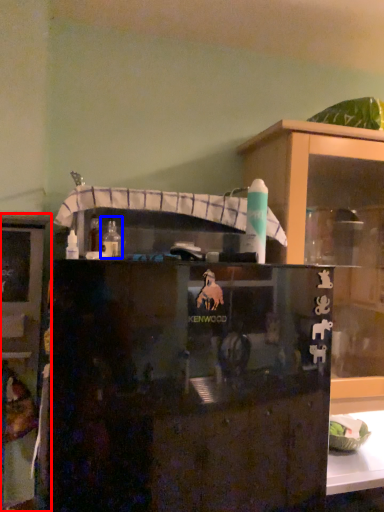
Question: Which point is further to the camera, cabinetry (highlighted by a red box) or bottle (highlighted by a blue box)?

Choices:
 (A) cabinetry
 (B) bottle

Answer: (A)